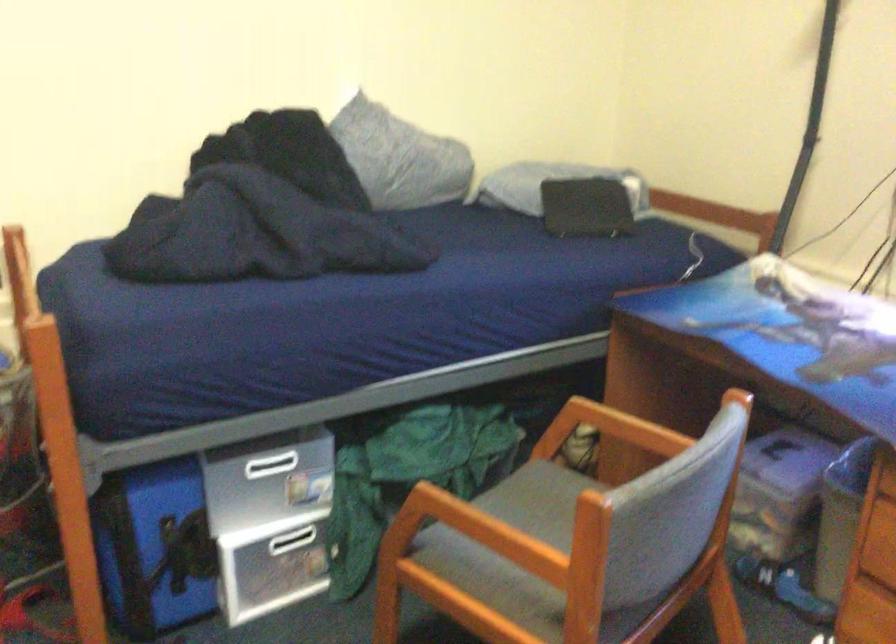
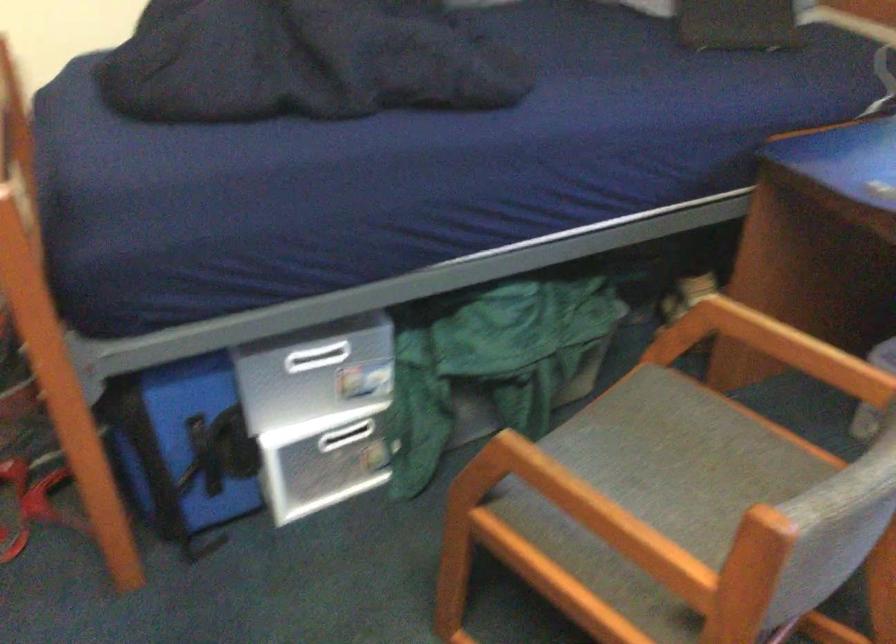
Find the pixel in the second image that matches point 627,419 in the first image.

(782, 328)